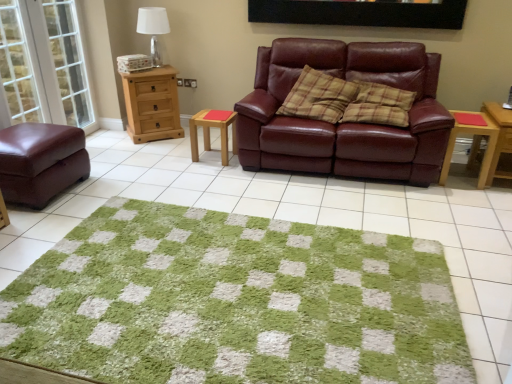
The height and width of the screenshot is (384, 512). In order to click on free point in front of wooden stool at center, which is the 3th table in right-to-left order in this screenshot , I will do `click(217, 169)`.